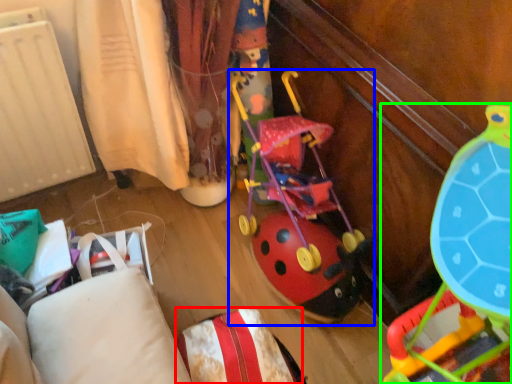
Question: Based on their relative distances, which object is farther from pillow (highlighted by a red box)? Choose from toy (highlighted by a blue box) and toy (highlighted by a green box).

Choices:
 (A) toy
 (B) toy

Answer: (A)